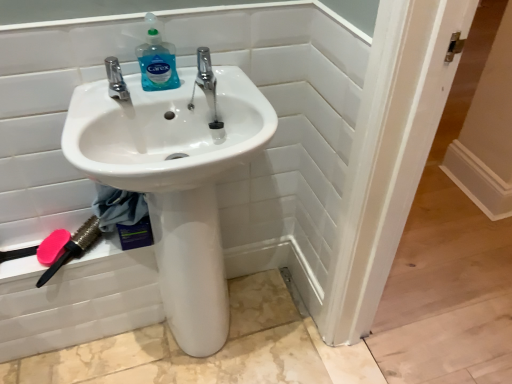
Find the location of `free point below pink plastic brush at lower left (from a real-world perspective)`. free point below pink plastic brush at lower left (from a real-world perspective) is located at coordinates (99, 331).